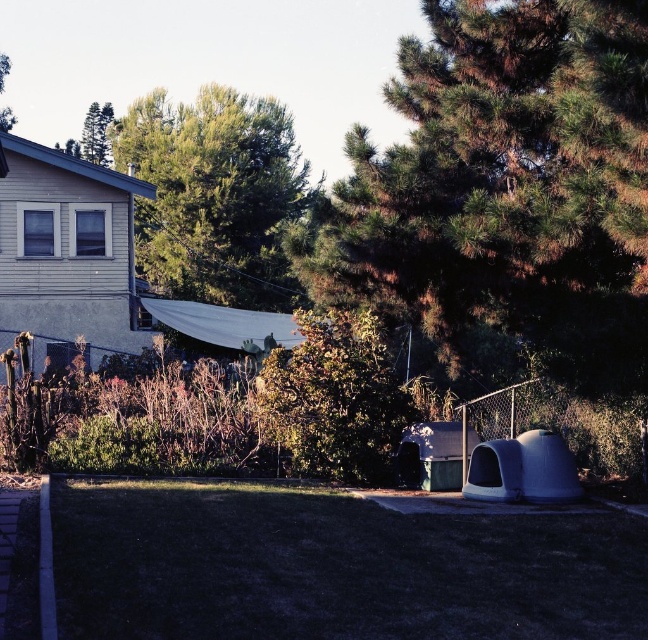
You are planning to plant a new flower bed in the backyard. You want to ensure it gets enough sunlight. Considering the position of the green textured tree at center and the green leafy tree at upper center, which tree might cast a shadow over the flower bed during the late afternoon or early evening when the sun is low?

The green leafy tree at upper center is positioned above the green textured tree at center, so it would cast a larger shadow over the flower bed during the late afternoon or early evening when the sun is low.

You are standing in the backyard and want to take a photo of both the green textured tree at center and the green textured tree at upper left. Which tree should you position yourself closer to in order to capture both in the same frame?

You should position yourself closer to the green textured tree at center since it is nearer to you than the green textured tree at upper left, allowing both trees to be included in the frame.